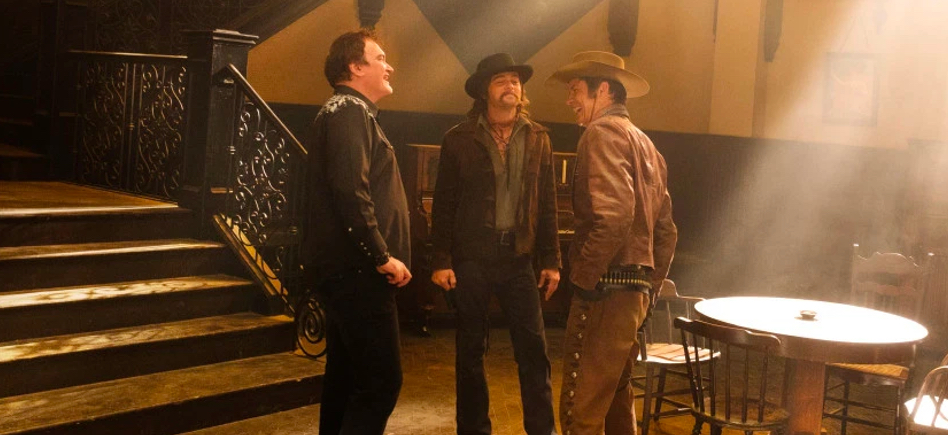
Where is `stair banister`? stair banister is located at coordinates (283, 122), (244, 79).